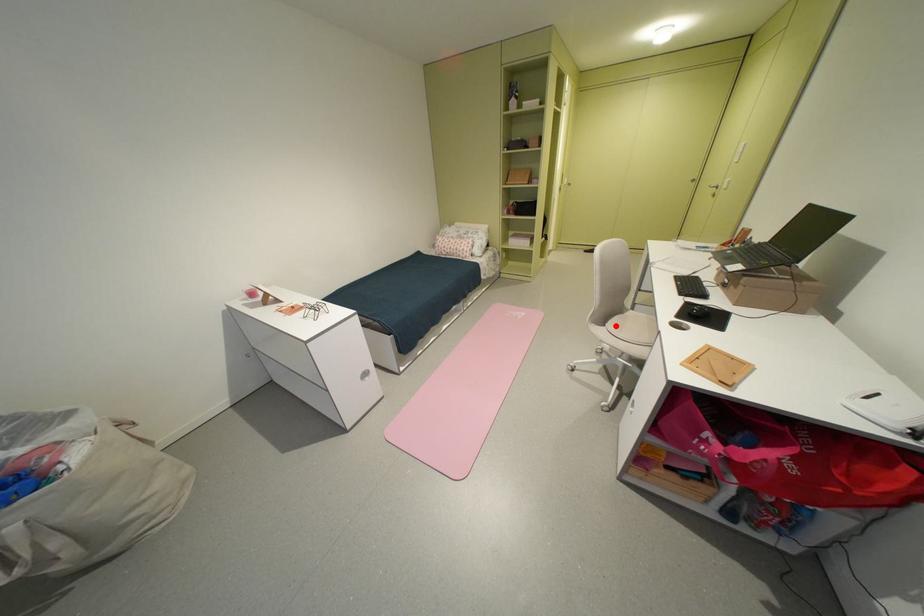
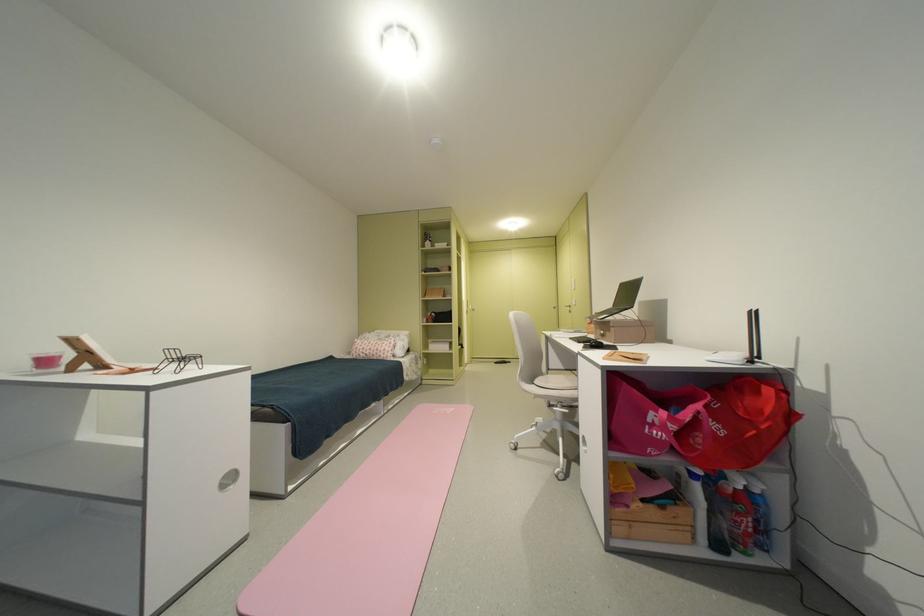
Question: I am providing you with two images of the same scene from different viewpoints. A red point is shown in image1. For the corresponding object point in image2, is it positioned nearer or farther from the camera?

Choices:
 (A) Nearer
 (B) Farther

Answer: (B)